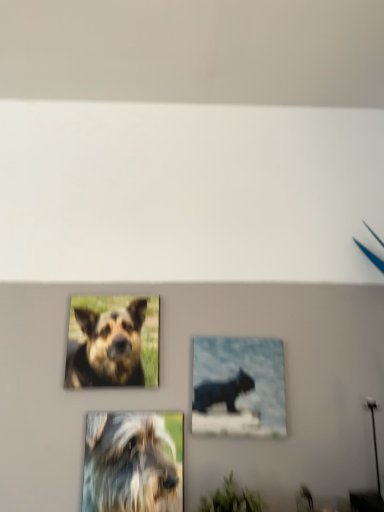
Question: From a real-world perspective, does matte black cat at center sit lower than fuzzy fur dog at center, which is the second dog from top to bottom?

Choices:
 (A) no
 (B) yes

Answer: (A)

Question: Is matte black cat at center next to fuzzy fur dog at center, which is the second dog from top to bottom?

Choices:
 (A) yes
 (B) no

Answer: (B)

Question: Can you confirm if matte black cat at center is positioned to the right of fuzzy fur dog at center, the 2th dog viewed from the back?

Choices:
 (A) yes
 (B) no

Answer: (A)

Question: Is matte black cat at center further to the viewer compared to fuzzy fur dog at center, the 2th dog viewed from the back?

Choices:
 (A) no
 (B) yes

Answer: (B)

Question: Considering the relative positions of matte black cat at center and fuzzy fur dog at center, the first dog ordered from the bottom, in the image provided, is matte black cat at center in front of fuzzy fur dog at center, the first dog ordered from the bottom,?

Choices:
 (A) no
 (B) yes

Answer: (A)

Question: From the image's perspective, would you say matte black cat at center is shown under fuzzy fur dog at center, the 2th dog viewed from the back?

Choices:
 (A) no
 (B) yes

Answer: (A)

Question: Is matte black cat at center aimed at brown fur dog at upper left, placed as the second dog when sorted from front to back?

Choices:
 (A) no
 (B) yes

Answer: (A)

Question: Is matte black cat at center next to brown fur dog at upper left, the first dog in the top-to-bottom sequence?

Choices:
 (A) no
 (B) yes

Answer: (A)

Question: From the image's perspective, is matte black cat at center under brown fur dog at upper left, which ranks as the 1th dog in back-to-front order?

Choices:
 (A) no
 (B) yes

Answer: (B)

Question: Does matte black cat at center appear on the right side of brown fur dog at upper left, which ranks as the 1th dog in back-to-front order?

Choices:
 (A) yes
 (B) no

Answer: (A)

Question: Is matte black cat at center turned away from brown fur dog at upper left, placed as the second dog when sorted from front to back?

Choices:
 (A) no
 (B) yes

Answer: (A)

Question: Considering the relative positions of matte black cat at center and brown fur dog at upper left, which ranks as the 1th dog in back-to-front order, in the image provided, is matte black cat at center to the left of brown fur dog at upper left, which ranks as the 1th dog in back-to-front order, from the viewer's perspective?

Choices:
 (A) no
 (B) yes

Answer: (A)

Question: Is matte black cat at center at the back of green matte plant at lower center?

Choices:
 (A) yes
 (B) no

Answer: (B)